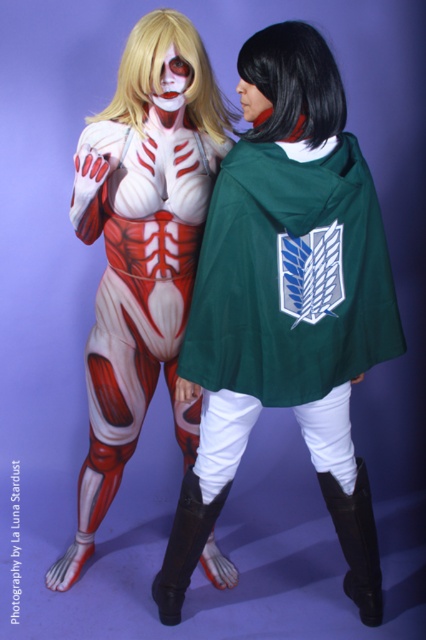
Does green fabric cape at center appear on the right side of black silky wig at center?

Correct, you'll find green fabric cape at center to the right of black silky wig at center.

Is green fabric cape at center wider than black silky wig at center?

Yes, green fabric cape at center is wider than black silky wig at center.

Is point (265, 227) less distant than point (310, 67)?

No, (265, 227) is further to viewer.

Locate an element on the screen. The image size is (426, 640). green fabric cape at center is located at coordinates pyautogui.click(x=290, y=275).

Who is shorter, black silky wig at center or blonde wig at upper center?

Standing shorter between the two is blonde wig at upper center.

Describe the element at coordinates (293, 81) in the screenshot. I see `black silky wig at center` at that location.

Between point (308, 38) and point (206, 118), which one is positioned behind?

Point (206, 118)

The width and height of the screenshot is (426, 640). Find the location of `black silky wig at center`. black silky wig at center is located at coordinates (293, 81).

Does green fabric cape at center have a lesser width compared to blonde wig at upper center?

No.

Is point (238, 228) farther from camera compared to point (144, 54)?

That is False.

Locate an element on the screen. green fabric cape at center is located at coordinates (290, 275).

Locate an element on the screen. Image resolution: width=426 pixels, height=640 pixels. green fabric cape at center is located at coordinates (290, 275).